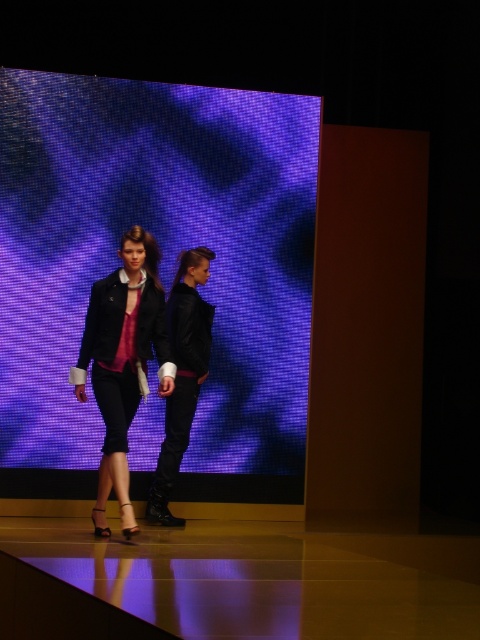
Question: Considering the relative positions of matte purple screen at center and shiny brown platform at lower center in the image provided, where is matte purple screen at center located with respect to shiny brown platform at lower center?

Choices:
 (A) right
 (B) left

Answer: (B)

Question: Which point is closer to the camera?

Choices:
 (A) shiny brown platform at lower center
 (B) leather jacket at center
 (C) matte black jacket at center
 (D) matte purple screen at center

Answer: (A)

Question: Considering the relative positions of shiny brown platform at lower center and leather jacket at center in the image provided, where is shiny brown platform at lower center located with respect to leather jacket at center?

Choices:
 (A) above
 (B) below

Answer: (B)

Question: Based on their relative distances, which object is farther from the matte black jacket at center?

Choices:
 (A) shiny brown platform at lower center
 (B) matte purple screen at center

Answer: (A)

Question: Among these points, which one is nearest to the camera?

Choices:
 (A) (182, 301)
 (B) (286, 156)
 (C) (113, 436)

Answer: (C)

Question: In this image, where is matte purple screen at center located relative to shiny brown platform at lower center?

Choices:
 (A) below
 (B) above

Answer: (B)